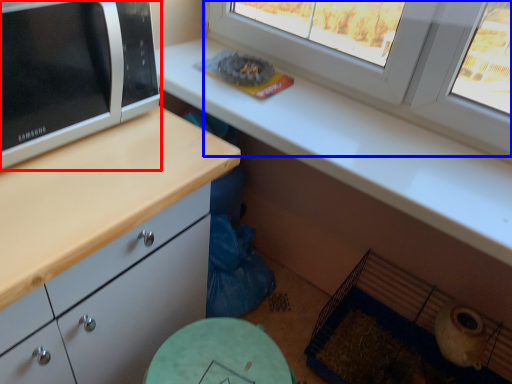
Question: Which object appears closest to the camera in this image, microwave oven (highlighted by a red box) or window (highlighted by a blue box)?

Choices:
 (A) microwave oven
 (B) window

Answer: (A)